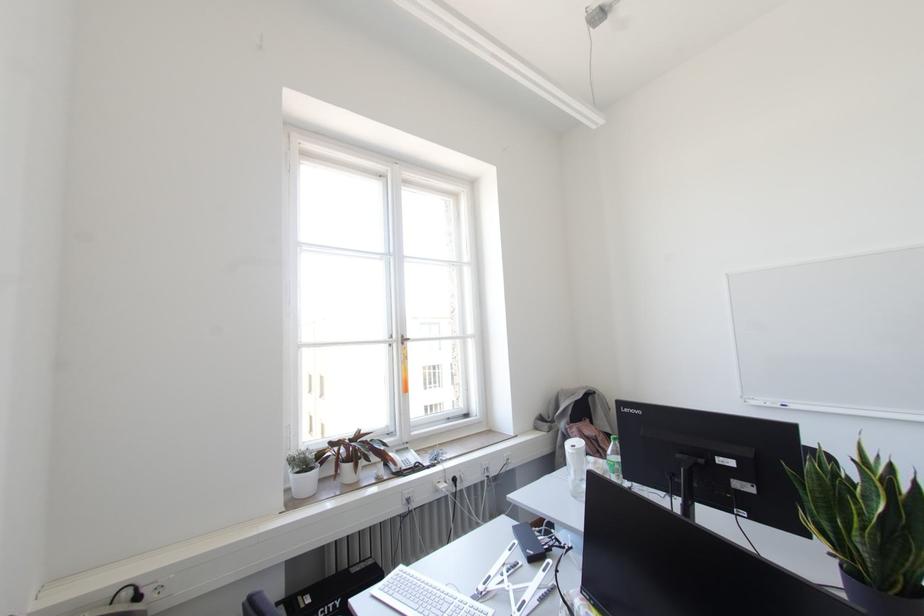
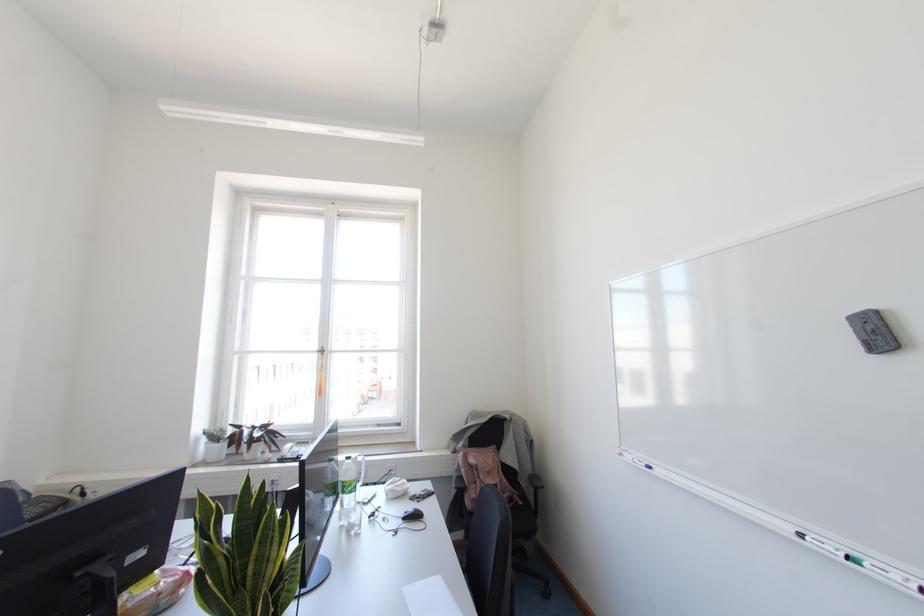
Question: Which direction would the cameraman need to move to produce the second image? Reply with the corresponding letter.

Choices:
 (A) Left
 (B) Right
 (C) Forward
 (D) Backward

Answer: (B)